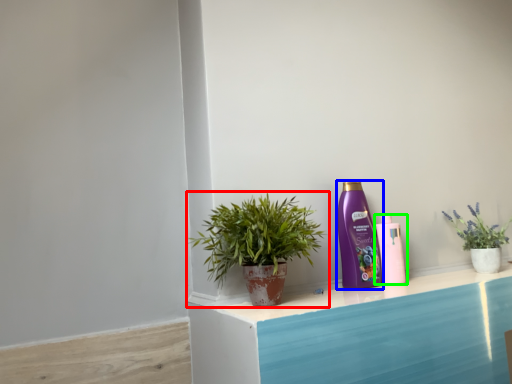
Question: Which is nearer to the houseplant (highlighted by a red box)? bottle (highlighted by a blue box) or bottle (highlighted by a green box).

Choices:
 (A) bottle
 (B) bottle

Answer: (A)